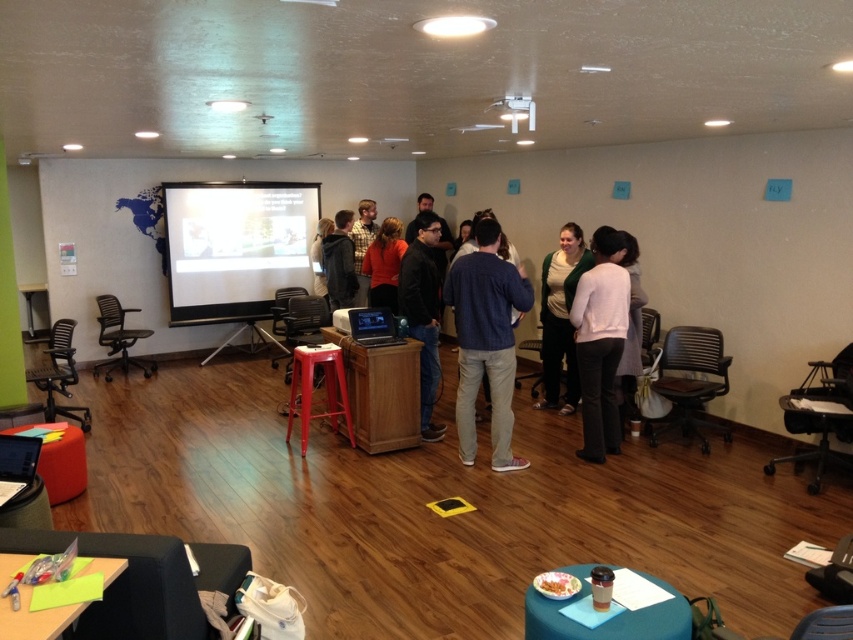
Can you confirm if knit sweater at center is bigger than white sweater at center?

Correct, knit sweater at center is larger in size than white sweater at center.

Consider the image. Is knit sweater at center above white sweater at center?

Yes.

Where is `knit sweater at center`? The width and height of the screenshot is (853, 640). knit sweater at center is located at coordinates (486, 340).

Is matte green sweater at center bigger than metallic red stool at center?

No, matte green sweater at center is not bigger than metallic red stool at center.

Does matte green sweater at center have a lesser width compared to metallic red stool at center?

Yes, matte green sweater at center is thinner than metallic red stool at center.

Does point (564, 324) lie behind point (334, 401)?

Yes, it is.

In order to click on matte green sweater at center in this screenshot , I will do `click(560, 316)`.

Does white sweater at center lie in front of black leather jacket at center?

Yes, it is in front of black leather jacket at center.

Is white sweater at center wider than black leather jacket at center?

Indeed, white sweater at center has a greater width compared to black leather jacket at center.

Between point (614, 285) and point (424, 244), which one is positioned behind?

The point (424, 244) is more distant.

What are the coordinates of `white sweater at center` in the screenshot? It's located at (601, 340).